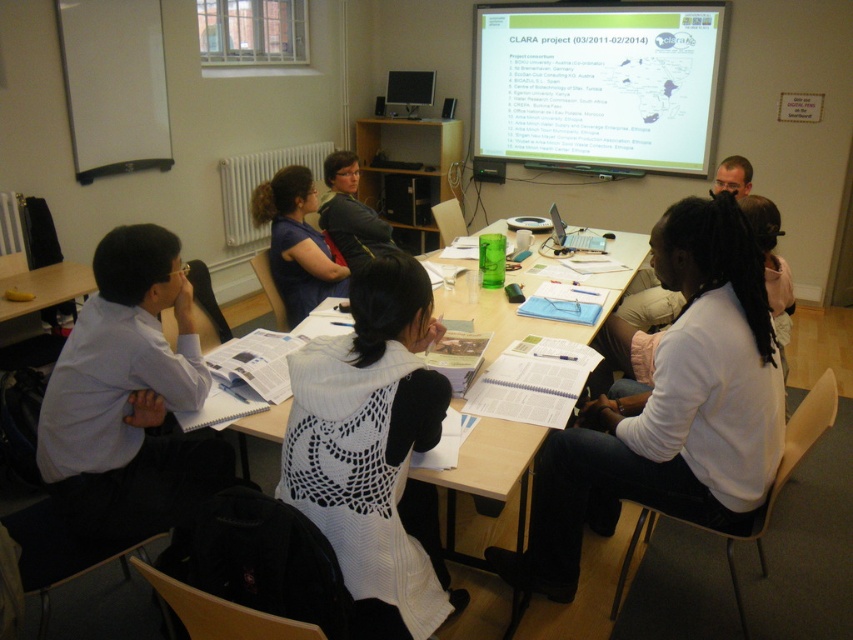
You are a photographer standing at the back of the classroom. You want to take a photo of the white knitted vest at center and the white shirt at left so that both are visible in the frame. Which object should you focus on first to ensure both are in focus?

The white knitted vest at center is taller than the white shirt at left, so focusing on the white knitted vest at center first would ensure both are in focus since it is closer to the camera.

You are organizing a presentation and need to choose a garment that can be easily seen from the back row of the classroom. Which item, the white knitted vest at center or the matte black sweater at center, would be more visible due to its size?

The white knitted vest at center has a larger size compared to the matte black sweater at center, making it more visible from the back row.

In the scene shown: You are standing at the back of the classroom and want to see the projection screen. Is the wooden table at center blocking your view of the matte black sweater at center?

The wooden table at center is located below matte black sweater at center, so the table is not blocking the view of the matte black sweater at center.